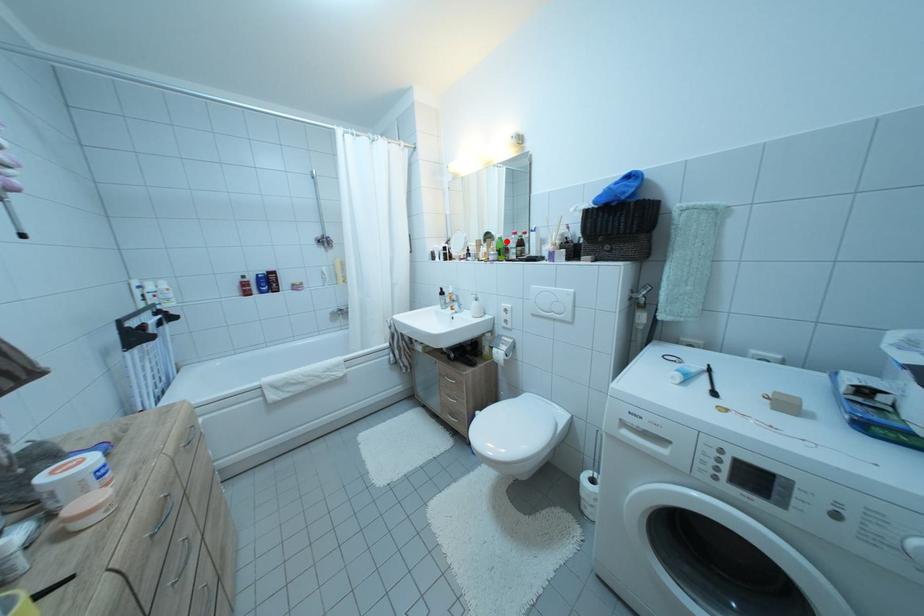
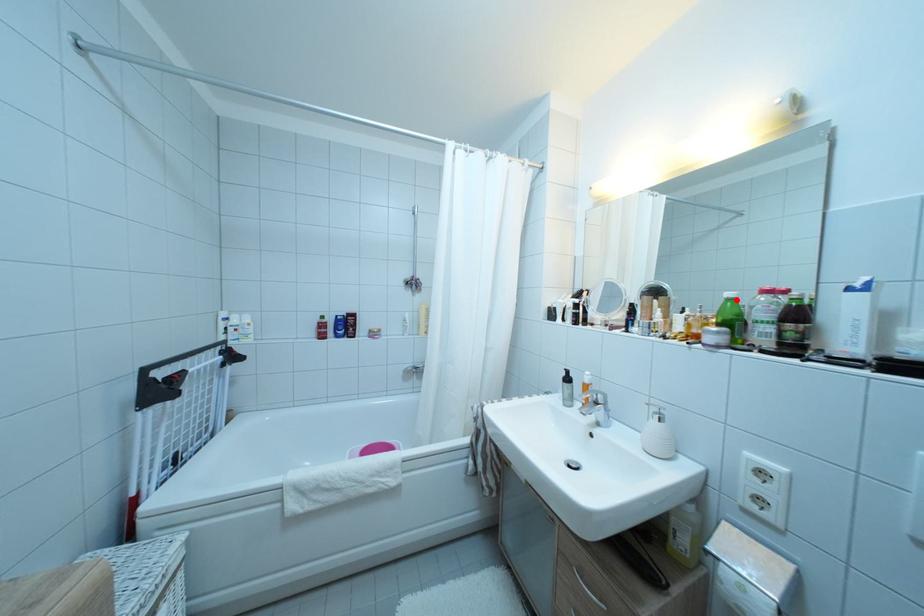
I am providing you with two images of the same scene from different viewpoints. A red point is marked on the first image and another point is marked on the second image. Do the highlighted points in image1 and image2 indicate the same real-world spot?

Yes